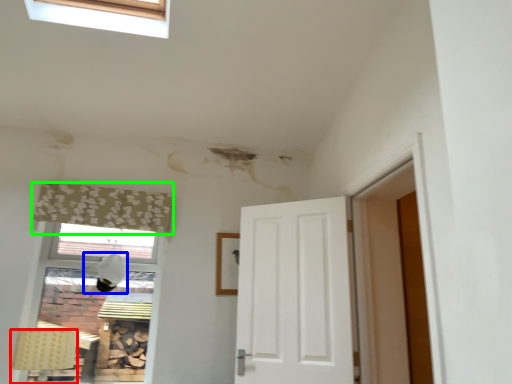
Question: Which object is positioned farthest from lamp (highlighted by a red box)? Select from lamp (highlighted by a blue box) and curtain (highlighted by a green box).

Choices:
 (A) lamp
 (B) curtain

Answer: (B)